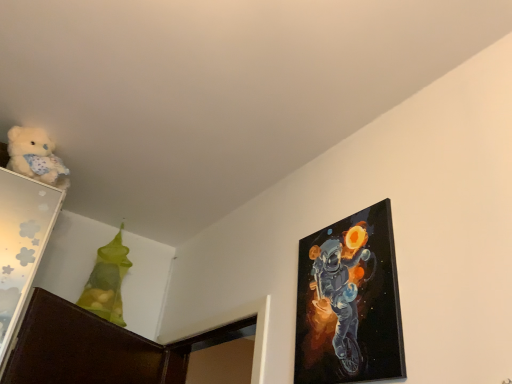
What do you see at coordinates (36, 157) in the screenshot? I see `fluffy white teddy bear at upper left` at bounding box center [36, 157].

The width and height of the screenshot is (512, 384). Find the location of `fluffy white teddy bear at upper left`. fluffy white teddy bear at upper left is located at coordinates (36, 157).

Is fluffy white teddy bear at upper left oriented towards translucent green bag at upper left?

No, fluffy white teddy bear at upper left is not aimed at translucent green bag at upper left.

Which object is further away from the camera taking this photo, fluffy white teddy bear at upper left or translucent green bag at upper left?

Positioned behind is translucent green bag at upper left.

In the scene shown: From a real-world perspective, is fluffy white teddy bear at upper left beneath translucent green bag at upper left?

Actually, fluffy white teddy bear at upper left is physically above translucent green bag at upper left in the real world.

Can translucent green bag at upper left be found inside fluffy white teddy bear at upper left?

No, translucent green bag at upper left is not surrounded by fluffy white teddy bear at upper left.

Is fluffy white teddy bear at upper left smaller than glossy canvas painting at upper right?

Incorrect, fluffy white teddy bear at upper left is not smaller in size than glossy canvas painting at upper right.

Can you tell me how much fluffy white teddy bear at upper left and glossy canvas painting at upper right differ in facing direction?

The facing directions of fluffy white teddy bear at upper left and glossy canvas painting at upper right are 79 degrees apart.

Is fluffy white teddy bear at upper left looking in the opposite direction of glossy canvas painting at upper right?

No, glossy canvas painting at upper right is not at the back of fluffy white teddy bear at upper left.

From the image's perspective, which object appears higher, fluffy white teddy bear at upper left or glossy canvas painting at upper right?

fluffy white teddy bear at upper left appears higher in the image.

Is glossy canvas painting at upper right shorter than translucent green bag at upper left?

Indeed, glossy canvas painting at upper right has a lesser height compared to translucent green bag at upper left.

Which object is closer to the camera, glossy canvas painting at upper right or translucent green bag at upper left?

glossy canvas painting at upper right.

Based on the photo, between glossy canvas painting at upper right and translucent green bag at upper left, which one has larger size?

translucent green bag at upper left.

How much distance is there between translucent green bag at upper left and fluffy white teddy bear at upper left?

A distance of 23.41 inches exists between translucent green bag at upper left and fluffy white teddy bear at upper left.

Is translucent green bag at upper left inside or outside of fluffy white teddy bear at upper left?

translucent green bag at upper left exists outside the volume of fluffy white teddy bear at upper left.

From a real-world perspective, is translucent green bag at upper left on top of fluffy white teddy bear at upper left?

Actually, translucent green bag at upper left is physically below fluffy white teddy bear at upper left in the real world.

In terms of size, does translucent green bag at upper left appear bigger or smaller than fluffy white teddy bear at upper left?

In the image, translucent green bag at upper left appears to be larger than fluffy white teddy bear at upper left.

Locate an element on the screen. Image resolution: width=512 pixels, height=384 pixels. picture frame in front of the translucent green bag at upper left is located at coordinates (349, 302).

From the image's perspective, is translucent green bag at upper left above or below glossy canvas painting at upper right?

translucent green bag at upper left is situated lower than glossy canvas painting at upper right in the image.

Which point is more forward, (109, 303) or (321, 270)?

The point (321, 270) is closer.

From a real-world perspective, does glossy canvas painting at upper right stand above fluffy white teddy bear at upper left?

Actually, glossy canvas painting at upper right is physically below fluffy white teddy bear at upper left in the real world.

From the image's perspective, is glossy canvas painting at upper right positioned above or below fluffy white teddy bear at upper left?

Clearly, from the image's perspective, glossy canvas painting at upper right is below fluffy white teddy bear at upper left.

Considering the relative sizes of glossy canvas painting at upper right and fluffy white teddy bear at upper left in the image provided, is glossy canvas painting at upper right taller than fluffy white teddy bear at upper left?

Yes, glossy canvas painting at upper right is taller than fluffy white teddy bear at upper left.

Measure the distance from glossy canvas painting at upper right to fluffy white teddy bear at upper left.

glossy canvas painting at upper right and fluffy white teddy bear at upper left are 1.15 meters apart.

Locate an element on the screen. The width and height of the screenshot is (512, 384). teddy bear that appears above the translucent green bag at upper left (from the image's perspective) is located at coordinates (36, 157).

Identify the location of teddy bear to the left of glossy canvas painting at upper right. Image resolution: width=512 pixels, height=384 pixels. (36, 157).

Which object lies nearer to the anchor point glossy canvas painting at upper right, fluffy white teddy bear at upper left or translucent green bag at upper left?

fluffy white teddy bear at upper left is closer to glossy canvas painting at upper right.

Based on their spatial positions, is glossy canvas painting at upper right or fluffy white teddy bear at upper left closer to translucent green bag at upper left?

fluffy white teddy bear at upper left is closer to translucent green bag at upper left.

From the image, which object appears to be nearer to translucent green bag at upper left, fluffy white teddy bear at upper left or glossy canvas painting at upper right?

Based on the image, fluffy white teddy bear at upper left appears to be nearer to translucent green bag at upper left.

From the image, which object appears to be farther from fluffy white teddy bear at upper left, glossy canvas painting at upper right or translucent green bag at upper left?

glossy canvas painting at upper right.

Based on their spatial positions, is translucent green bag at upper left or glossy canvas painting at upper right closer to fluffy white teddy bear at upper left?

translucent green bag at upper left is closer to fluffy white teddy bear at upper left.

From the image, which object appears to be nearer to glossy canvas painting at upper right, translucent green bag at upper left or fluffy white teddy bear at upper left?

Based on the image, fluffy white teddy bear at upper left appears to be nearer to glossy canvas painting at upper right.

Where is `toy situated between fluffy white teddy bear at upper left and glossy canvas painting at upper right from left to right`? The image size is (512, 384). toy situated between fluffy white teddy bear at upper left and glossy canvas painting at upper right from left to right is located at coordinates (106, 282).